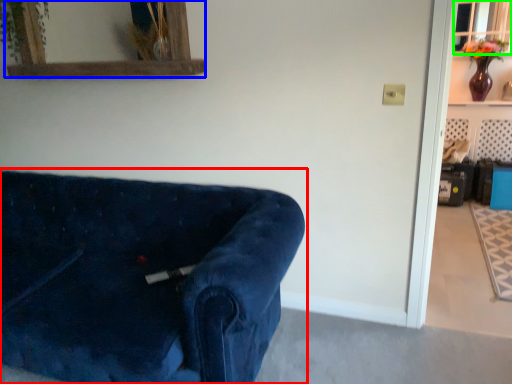
Question: Based on their relative distances, which object is farther from studio couch (highlighted by a red box)? Choose from mirror (highlighted by a blue box) and window (highlighted by a green box).

Choices:
 (A) mirror
 (B) window

Answer: (B)